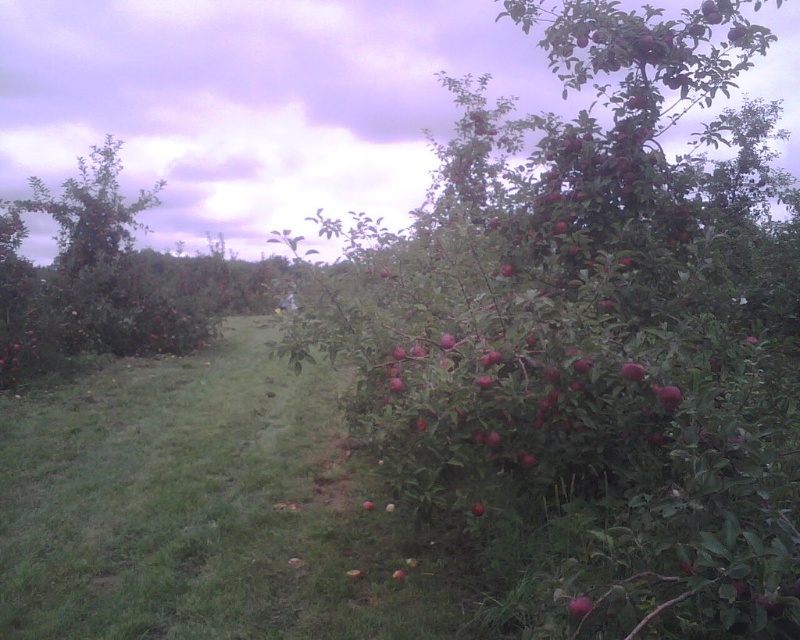
You are a gardener who wants to place a small decorative rock on the green grass at center. You have a shiny red apple at lower right nearby. Which object is wider so that the rock can fit without overlapping?

The green grass at center is wider than the shiny red apple at lower right, so placing the rock on the green grass at center would be appropriate without overlapping.